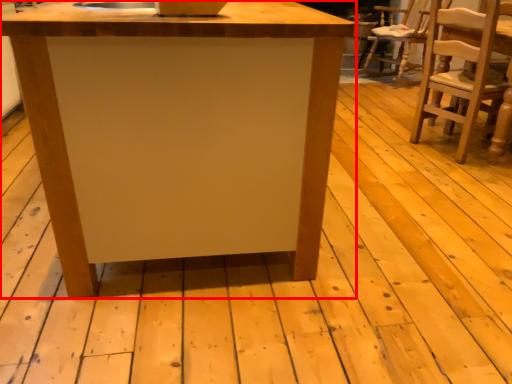
Question: From the image's perspective, what is the correct spatial relationship of table (annotated by the red box) in relation to chair?

Choices:
 (A) below
 (B) above

Answer: (A)